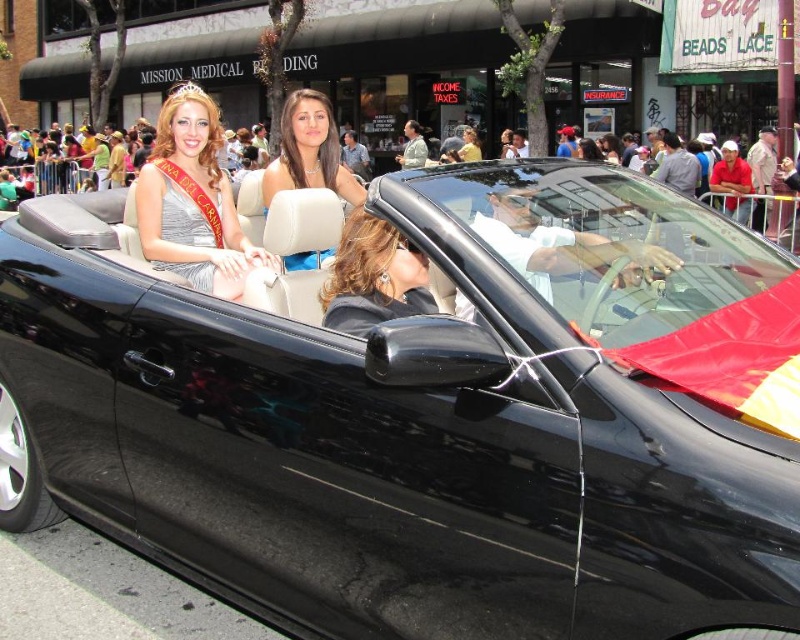
Between point (154, 225) and point (294, 99), which one is positioned behind?

The point (294, 99) is more distant.

Which is more to the right, satin silver dress at upper left or blue satin dress at center?

blue satin dress at center is more to the right.

This screenshot has width=800, height=640. What are the coordinates of `satin silver dress at upper left` in the screenshot? It's located at (192, 202).

Locate an element on the screen. The image size is (800, 640). satin silver dress at upper left is located at coordinates (192, 202).

Does satin silver dress at upper left have a lesser width compared to shiny black hair at center?

No.

How much distance is there between satin silver dress at upper left and shiny black hair at center?

A distance of 37.92 inches exists between satin silver dress at upper left and shiny black hair at center.

Is point (218, 116) positioned before point (380, 308)?

No.

In order to click on satin silver dress at upper left in this screenshot , I will do `click(192, 202)`.

Which is behind, point (354, 221) or point (310, 180)?

Positioned behind is point (310, 180).

Where is `shiny black hair at center`? Image resolution: width=800 pixels, height=640 pixels. shiny black hair at center is located at coordinates (374, 276).

Between point (368, 212) and point (296, 124), which one is positioned in front?

Point (368, 212) is in front.

This screenshot has width=800, height=640. Identify the location of shiny black hair at center. (374, 276).